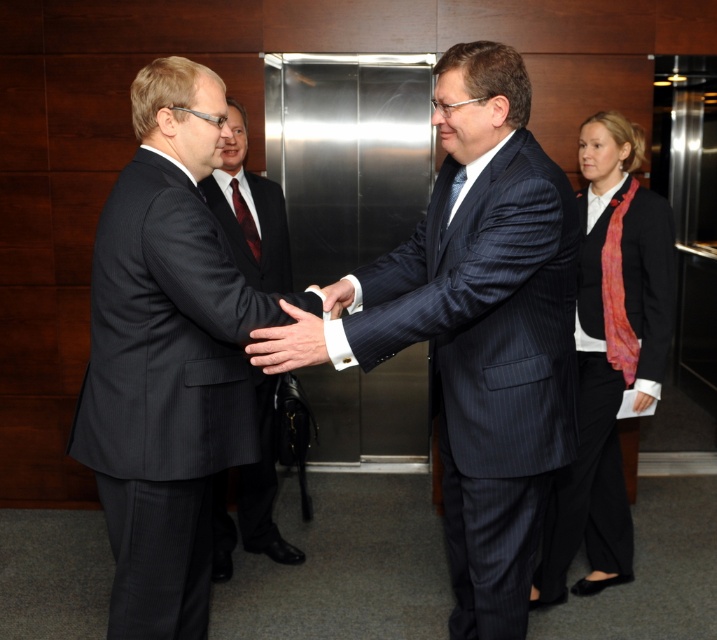
You are an event planner organizing a corporate event. You need to ensure that the dark blue pinstripe suit at center and the dark blue silk tie at center are displayed properly in promotional materials. Which object should you focus on adjusting the camera angle to capture its full height?

The dark blue pinstripe suit at center has a greater height compared to the dark blue silk tie at center, so you should focus on adjusting the camera angle to capture its full height.

You are a tailor observing a formal meeting. You need to determine which of the two suits at the center, the dark blue pinstripe suit at center or the dark gray pinstripe suit at center, requires more fabric for alterations. Based on their sizes, which one would need more material?

The dark gray pinstripe suit at center requires more fabric for alterations since it has a greater width than the dark blue pinstripe suit at center.

Consider the image. What is the exact position of the shiny red tie at center in the image?

The shiny red tie at center is located at point coordinates of (244, 220).